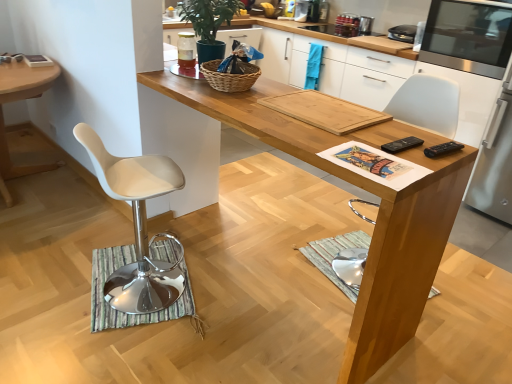
Find the location of a particular element. vacant space to the left of wooden cutting board at center is located at coordinates (253, 107).